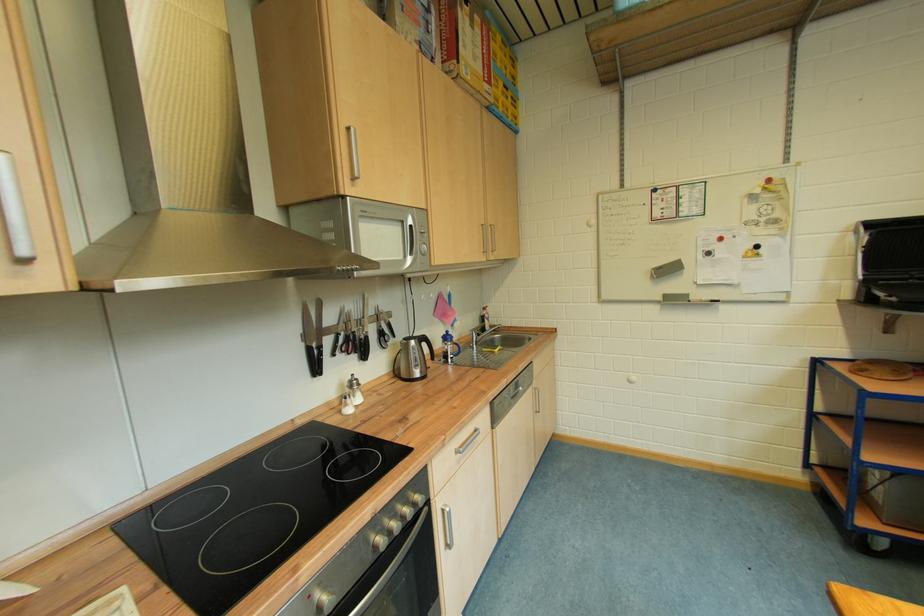
This screenshot has height=616, width=924. What do you see at coordinates (397, 577) in the screenshot?
I see `the oven handle` at bounding box center [397, 577].